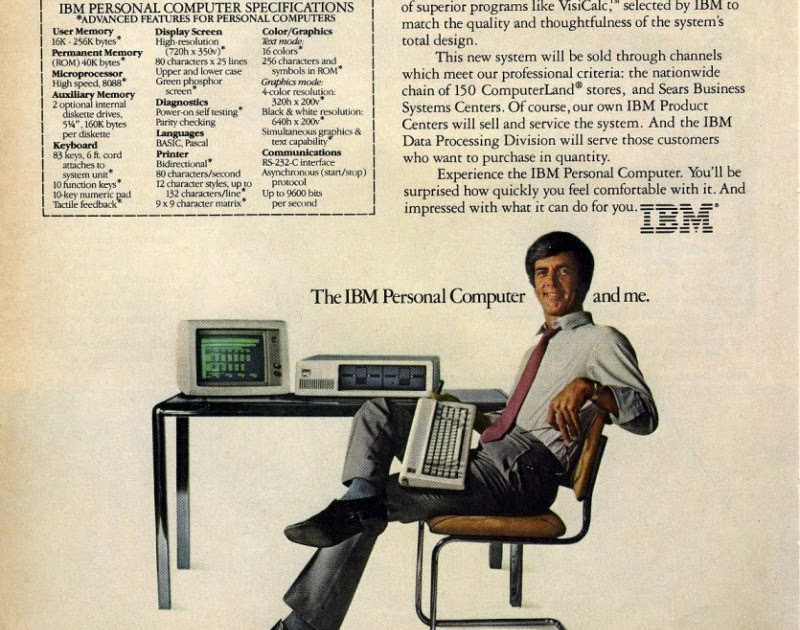
Find the location of a particular element. The width and height of the screenshot is (800, 630). computer screen is located at coordinates (234, 355).